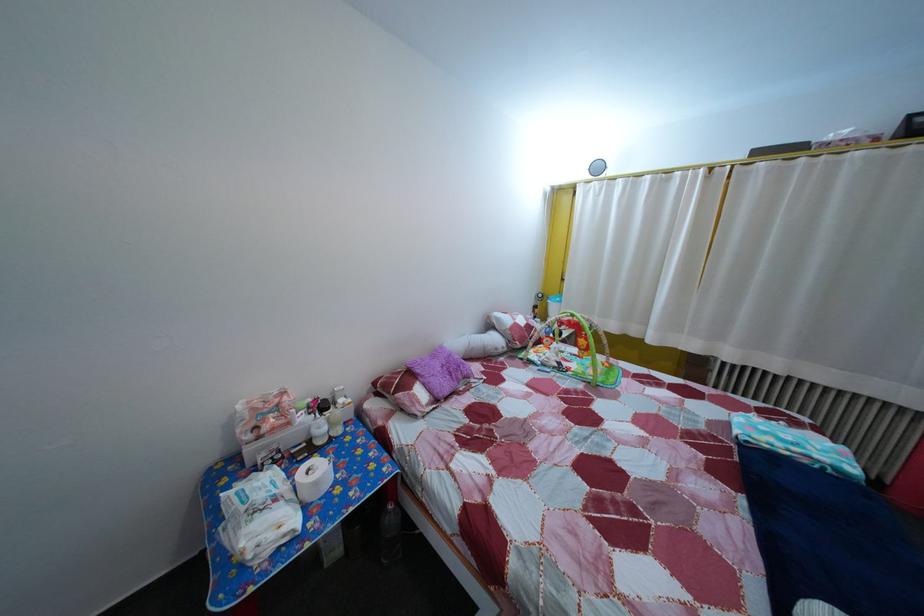
The width and height of the screenshot is (924, 616). In order to click on purple fluffy pillow in this screenshot , I will do `click(440, 371)`.